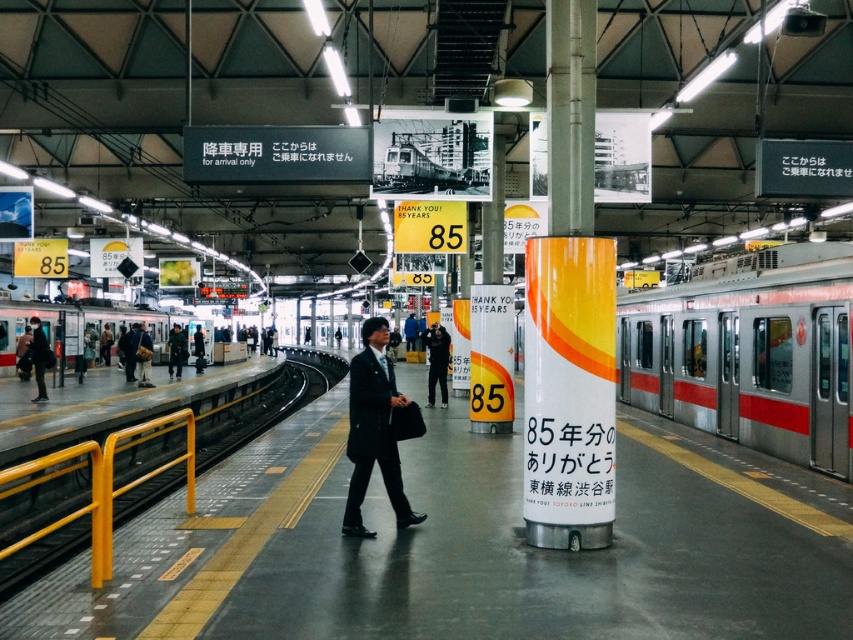
How much distance is there between silver metallic train at right and orange glossy pole at center?

The distance of silver metallic train at right from orange glossy pole at center is 15.77 feet.

Looking at this image, who is shorter, silver metallic train at right or orange glossy pole at center?

silver metallic train at right

Does point (831, 464) come behind point (569, 250)?

Yes, point (831, 464) is behind point (569, 250).

I want to click on silver metallic train at right, so (x=749, y=352).

Does smooth concrete platform at center appear on the left side of silver metallic train at right?

Correct, you'll find smooth concrete platform at center to the left of silver metallic train at right.

Is point (367, 616) positioned in front of point (521, 339)?

Yes, it is in front of point (521, 339).

Locate an element on the screen. This screenshot has height=640, width=853. smooth concrete platform at center is located at coordinates (466, 547).

Can you confirm if black suit at center is wider than silver metallic train at left?

Incorrect, black suit at center's width does not surpass silver metallic train at left's.

This screenshot has height=640, width=853. Find the location of `black suit at center`. black suit at center is located at coordinates (373, 429).

Where is `black suit at center`? Image resolution: width=853 pixels, height=640 pixels. black suit at center is located at coordinates (373, 429).